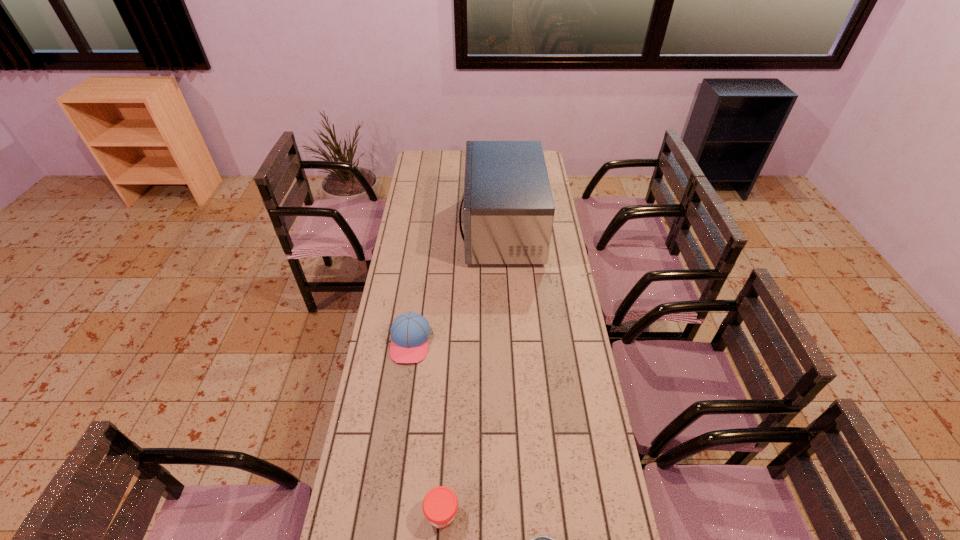
The height and width of the screenshot is (540, 960). I want to click on vacant position located 0.310m on the label side of the second nearest object, so click(x=571, y=514).

Identify the location of object located in the left edge section of the desktop. This screenshot has width=960, height=540. (410, 332).

Identify the location of object located at the right edge. (508, 210).

This screenshot has height=540, width=960. Identify the location of free location at the left edge of the desktop. (412, 253).

Locate an element on the screen. Image resolution: width=960 pixels, height=540 pixels. vacant space at the right edge is located at coordinates (551, 257).

Identify the location of unoccupied area between the third nearest object and the tallest object. The width and height of the screenshot is (960, 540). (456, 286).

At what (x,y) coordinates should I click in order to perform the action: click on free space between the second farthest object and the tallest object. Please return your answer as a coordinate pair (x, y). Looking at the image, I should click on (456, 286).

Where is `free space between the second nearest object and the third nearest object`? This screenshot has height=540, width=960. free space between the second nearest object and the third nearest object is located at coordinates (426, 428).

Locate which object ranks third in proximity to the second shortest object. Please provide its 2D coordinates. Your answer should be formatted as a tuple, i.e. [(x, y)], where the tuple contains the x and y coordinates of a point satisfying the conditions above.

[(508, 210)]

Locate an element on the screen. This screenshot has height=540, width=960. object that stands as the second closest to the nearest object is located at coordinates (410, 332).